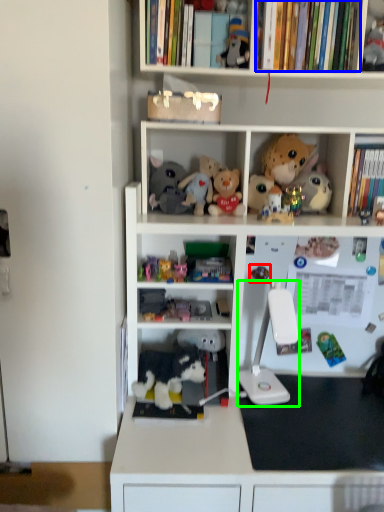
Question: Which object is positioned closest to toy (highlighted by a red box)? Select from book (highlighted by a blue box) and equipment (highlighted by a green box).

Choices:
 (A) book
 (B) equipment

Answer: (B)